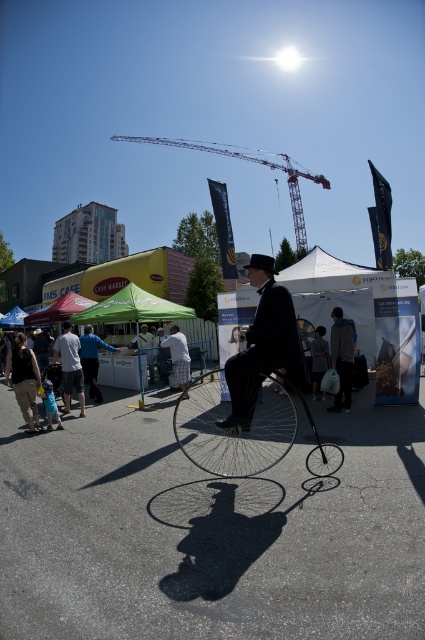
Question: Among these points, which one is nearest to the camera?

Choices:
 (A) (88, 380)
 (B) (73, 369)
 (C) (316, 337)

Answer: (B)

Question: Estimate the real-world distances between objects in this image. Which object is farther from the metallic red crane at upper center?

Choices:
 (A) white cotton shirt at center
 (B) light blue denim shorts at center
 (C) dark gray fabric jacket at center

Answer: (A)

Question: Is green fabric canopy at center positioned at the back of light blue shirt at center?

Choices:
 (A) yes
 (B) no

Answer: (A)

Question: Which of these objects is positioned farthest from the light blue shirt at center?

Choices:
 (A) white cotton shirt at center
 (B) dark brown leather pants at lower left

Answer: (B)

Question: Is light blue shirt at center below dark gray fabric jacket at center?

Choices:
 (A) yes
 (B) no

Answer: (B)

Question: Can you confirm if dark brown leather coat at center is positioned above white cotton shirt at center?

Choices:
 (A) yes
 (B) no

Answer: (A)